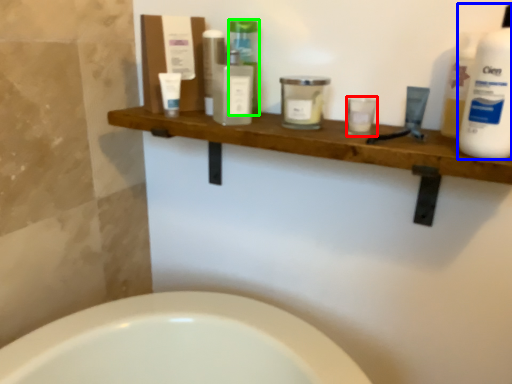
Question: Which is nearer to the toiletry (highlighted by a red box)? cleaning product (highlighted by a blue box) or toiletry (highlighted by a green box).

Choices:
 (A) cleaning product
 (B) toiletry

Answer: (A)